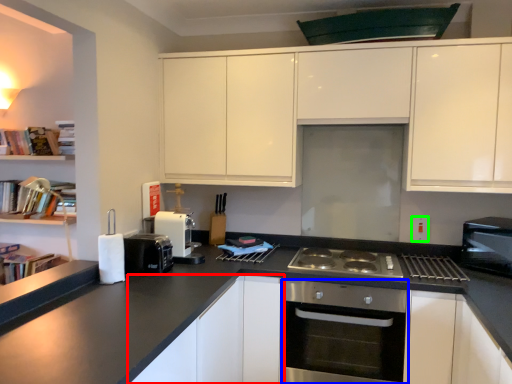
Question: Which object is the closest to the cabinetry (highlighted by a red box)? Choose among these: oven (highlighted by a blue box) or electric outlet (highlighted by a green box).

Choices:
 (A) oven
 (B) electric outlet

Answer: (A)